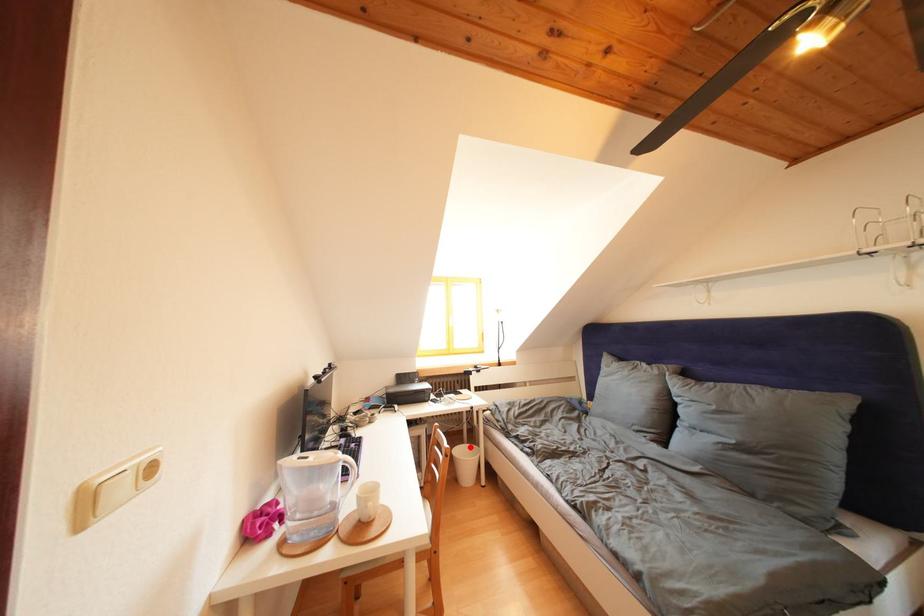
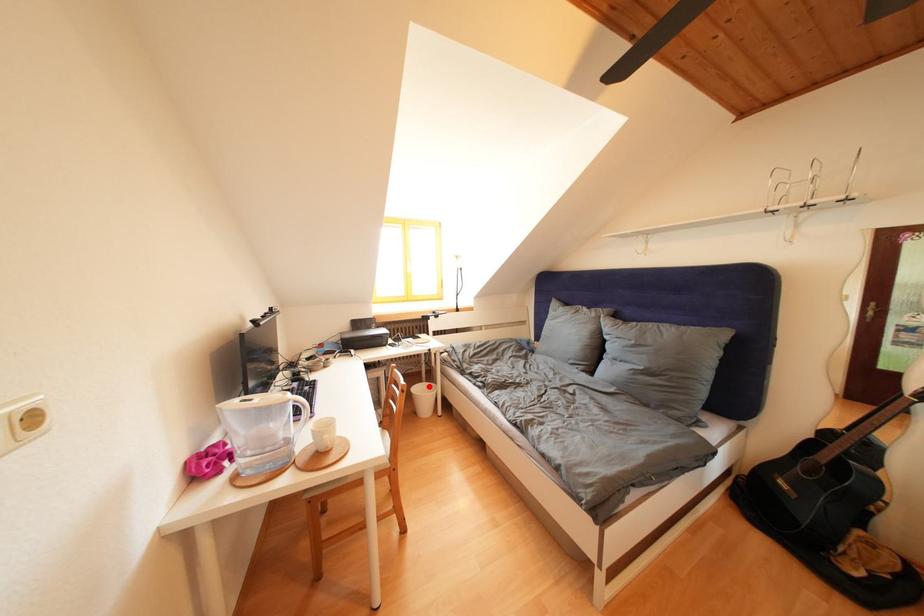
I am providing you with two images of the same scene from different viewpoints. A red point is marked on the first image and another point is marked on the second image. Are the points marked in image1 and image2 representing the same 3D position?

Yes